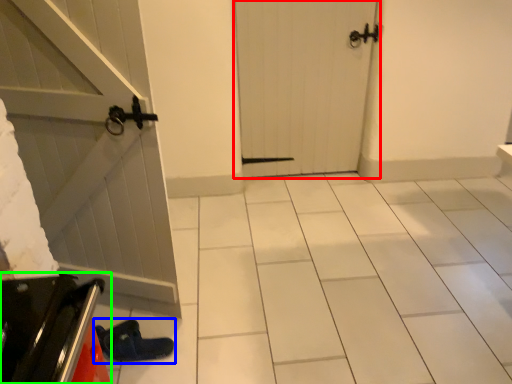
Question: Which object is positioned closest to door (highlighted by a red box)? Select from footwear (highlighted by a blue box) and appliance (highlighted by a green box).

Choices:
 (A) footwear
 (B) appliance

Answer: (A)